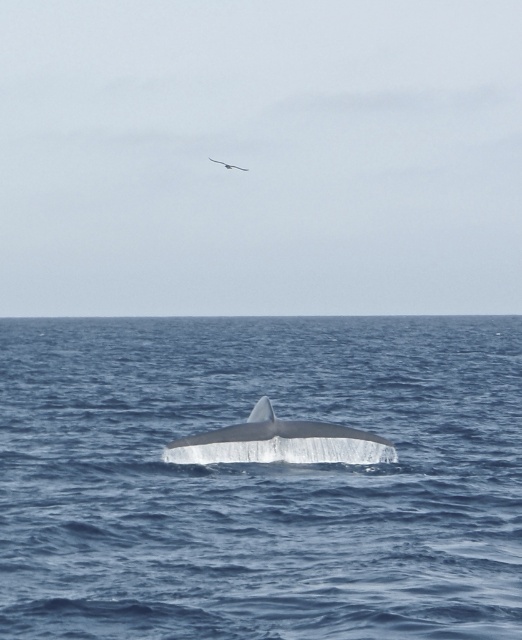
Question: Is blue smooth water at center above white smooth whale at center?

Choices:
 (A) no
 (B) yes

Answer: (B)

Question: Can you confirm if blue smooth water at center is positioned below white smooth whale at center?

Choices:
 (A) yes
 (B) no

Answer: (B)

Question: Which object is closer to the camera taking this photo?

Choices:
 (A) white smooth whale at center
 (B) blue smooth water at center

Answer: (B)

Question: Which point is closer to the camera?

Choices:
 (A) blue smooth water at center
 (B) white smooth whale at center

Answer: (A)

Question: Does blue smooth water at center lie behind white smooth whale at center?

Choices:
 (A) yes
 (B) no

Answer: (B)

Question: Which of the following is the farthest from the observer?

Choices:
 (A) (385, 451)
 (B) (162, 413)

Answer: (B)